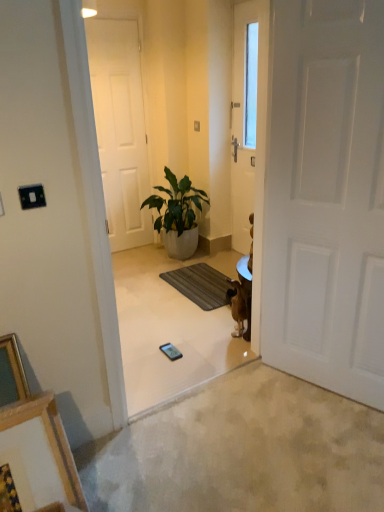
Question: Is white matte door at center, which is the second door from right to left, taller or shorter than green leafy plant in white pot at center?

Choices:
 (A) short
 (B) tall

Answer: (B)

Question: Based on their positions, is white matte door at center, which is the second door from right to left, located to the left or right of green leafy plant in white pot at center?

Choices:
 (A) right
 (B) left

Answer: (B)

Question: Which object is the farthest from the dark gray textured mat at center?

Choices:
 (A) green leafy plant in white pot at center
 (B) brown fur dog at center-right
 (C) black glossy mobile phone at center
 (D) white matte door at right, the second door when ordered from left to right
 (E) wooden picture frame at lower left

Answer: (E)

Question: Which is nearer to the white matte door at center, which is counted as the 1th door, starting from the back?

Choices:
 (A) green leafy plant in white pot at center
 (B) white matte door at right, the 1th door when ordered from front to back
 (C) wooden picture frame at lower left
 (D) brown fur dog at center-right
 (E) dark gray textured mat at center

Answer: (A)